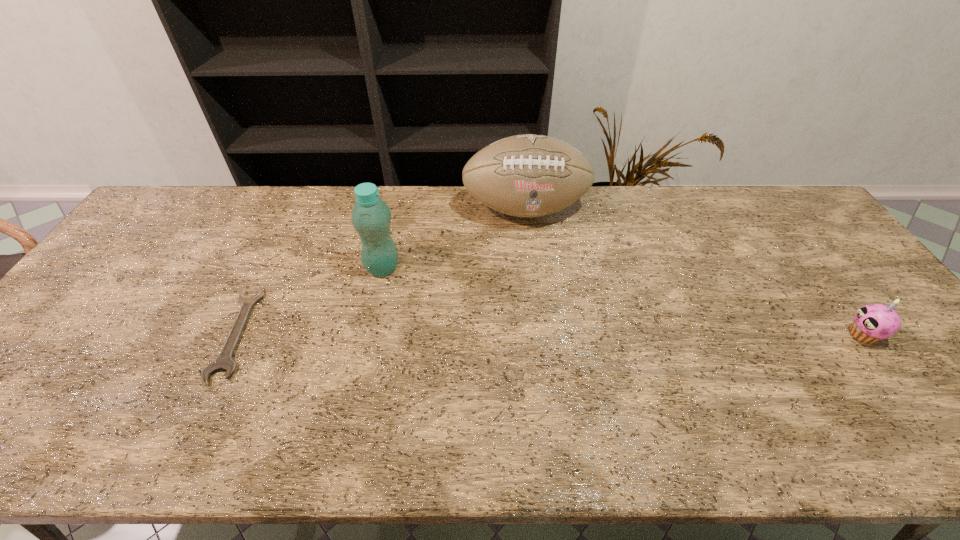
The height and width of the screenshot is (540, 960). I want to click on unoccupied area between the rightmost object and the third nearest object, so click(623, 301).

Where is `free spot between the third tallest object and the shortest object`? This screenshot has height=540, width=960. free spot between the third tallest object and the shortest object is located at coordinates (550, 334).

You are a GUI agent. You are given a task and a screenshot of the screen. Output one action in this format:
    pyautogui.click(x=<x>, y=<y>)
    Task: Click on the vacant space that is in between the leftmost object and the third object from right to left
    Image resolution: width=960 pixels, height=540 pixels.
    Given the screenshot: What is the action you would take?
    pyautogui.click(x=310, y=300)

The height and width of the screenshot is (540, 960). Identify the location of the second closest object to the cupcake. (371, 216).

Image resolution: width=960 pixels, height=540 pixels. In order to click on object that is the third nearest to the farthest object in this screenshot , I will do `click(874, 322)`.

Locate an element on the screen. This screenshot has width=960, height=540. vacant region that satisfies the following two spatial constraints: 1. on the back side of the water bottle; 2. on the left side of the shortest object is located at coordinates (269, 268).

Where is `vacant region that satisfies the following two spatial constraints: 1. on the front side of the wrench; 2. on the face of the rightmost object`? The image size is (960, 540). vacant region that satisfies the following two spatial constraints: 1. on the front side of the wrench; 2. on the face of the rightmost object is located at coordinates (237, 335).

In order to click on vacant region that satisfies the following two spatial constraints: 1. on the back side of the football (American); 2. on the right side of the wrench in this screenshot , I will do `click(297, 209)`.